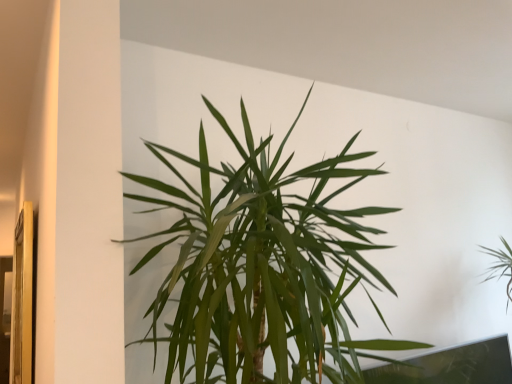
Question: Is green leafy plant at upper right, the 2th houseplant when ordered from front to back, in front of or behind green leafy plant at center, placed as the 2th houseplant when sorted from back to front, in the image?

Choices:
 (A) behind
 (B) front

Answer: (A)

Question: From their relative heights in the image, would you say green leafy plant at upper right, the 2th houseplant viewed from the left, is taller or shorter than green leafy plant at center, placed as the 2th houseplant when sorted from back to front?

Choices:
 (A) short
 (B) tall

Answer: (A)

Question: Based on their positions, is green leafy plant at upper right, the first houseplant in the right-to-left sequence, located to the left or right of green leafy plant at center, placed as the 2th houseplant when sorted from back to front?

Choices:
 (A) right
 (B) left

Answer: (A)

Question: Is point (178, 269) closer or farther from the camera than point (493, 264)?

Choices:
 (A) farther
 (B) closer

Answer: (B)

Question: From the image's perspective, relative to green leafy plant at upper right, the 2th houseplant viewed from the left, is green leafy plant at center, arranged as the 2th houseplant when viewed from the right, above or below?

Choices:
 (A) below
 (B) above

Answer: (B)

Question: Looking at their shapes, would you say green leafy plant at center, placed as the 2th houseplant when sorted from back to front, is wider or thinner than green leafy plant at upper right, the 2th houseplant viewed from the left?

Choices:
 (A) thin
 (B) wide

Answer: (B)

Question: Is green leafy plant at center, placed as the 2th houseplant when sorted from back to front, situated inside green leafy plant at upper right, the 2th houseplant when ordered from front to back, or outside?

Choices:
 (A) inside
 (B) outside

Answer: (B)